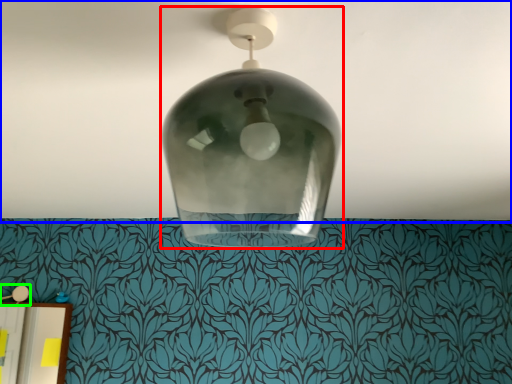
Question: Which object is the closest to the lamp (highlighted by a red box)? Choose among these: atmosphere (highlighted by a blue box) or lamp (highlighted by a green box).

Choices:
 (A) atmosphere
 (B) lamp

Answer: (A)